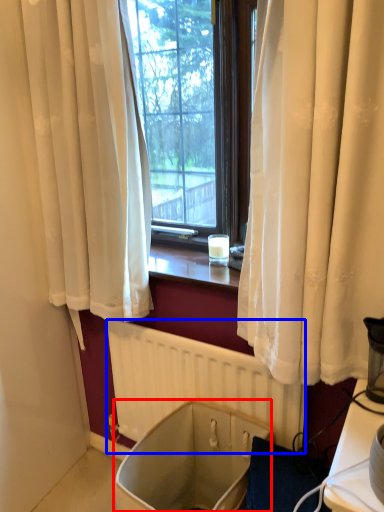
Question: Among these objects, which one is farthest to the camera, bath (highlighted by a red box) or radiator (highlighted by a blue box)?

Choices:
 (A) bath
 (B) radiator

Answer: (B)